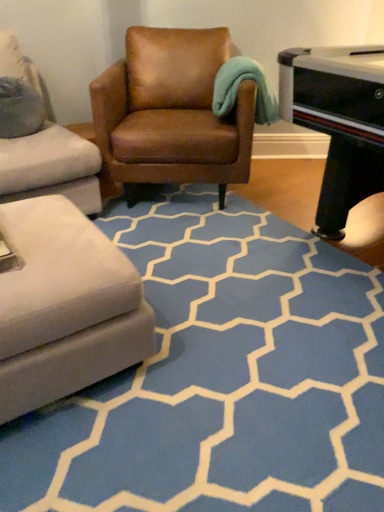
Question: Relative to blue carpet at center, is brown leather chair at center in front or behind?

Choices:
 (A) front
 (B) behind

Answer: (B)

Question: Visually, is brown leather chair at center positioned to the left or to the right of blue carpet at center?

Choices:
 (A) right
 (B) left

Answer: (B)

Question: Is brown leather chair at center taller or shorter than blue carpet at center?

Choices:
 (A) short
 (B) tall

Answer: (B)

Question: Visually, is blue carpet at center positioned to the left or to the right of brown leather chair at center?

Choices:
 (A) left
 (B) right

Answer: (B)

Question: From the image's perspective, is blue carpet at center located above or below brown leather chair at center?

Choices:
 (A) above
 (B) below

Answer: (B)

Question: Relative to brown leather chair at center, is blue carpet at center in front or behind?

Choices:
 (A) front
 (B) behind

Answer: (A)

Question: Is point (208, 424) closer or farther from the camera than point (195, 96)?

Choices:
 (A) closer
 (B) farther

Answer: (A)